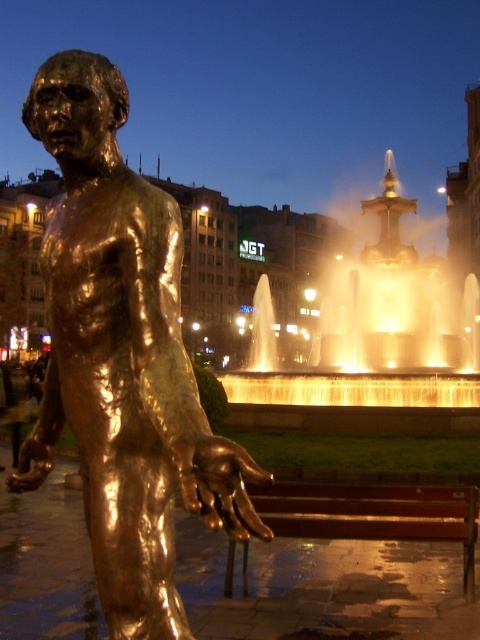
You are a photographer standing in the public square. You want to take a photo of the bronze polished bench at lower center without the golden reflective water at center appearing in the foreground. Is this possible based on their positions?

The bronze polished bench at lower center is behind the golden reflective water at center, so you can position yourself so that the bench is framed behind the water, but since the water is in the center and the bench is behind it, you might still see the water in front of the bench. To avoid the water in the foreground, you would need to move to a position where the bench is not aligned with the water, but based on their spatial relationship, it might be challenging to completely exclude the golden water at

In the scene shown: You are a photographer positioned at the center of the square. You want to take a photo of the bronze statue at left and the bronze polished bench at lower center. Which object will appear larger in your photo?

The bronze statue at left appears larger in the photo because it is closer to the photographer than the bronze polished bench at lower center.

Looking at this image, you are standing in the public square and want to take a photo of both the bronze statue at left and the golden reflective water at center. Which object should you focus on first to ensure both are in the frame?

You should focus on the bronze statue at left first since it is closer to you, allowing you to frame it and then adjust the camera to include the golden reflective water at center in the background.